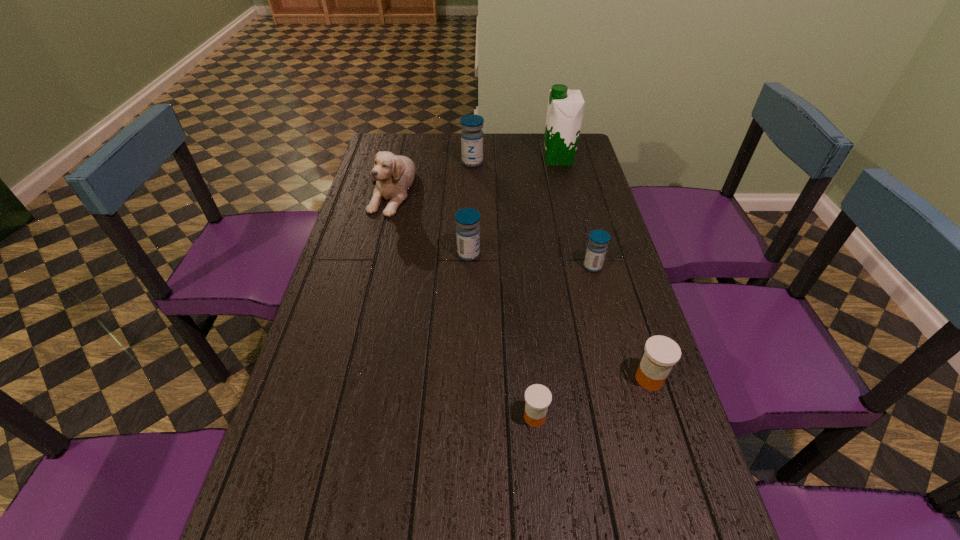
Locate an element on the screen. The image size is (960, 540). green soya milk is located at coordinates (565, 109).

This screenshot has width=960, height=540. I want to click on the tallest object, so click(x=565, y=109).

Identify the location of the farthest medicine. (471, 136).

The width and height of the screenshot is (960, 540). Find the location of `the tallest medicine`. the tallest medicine is located at coordinates (471, 136).

What are the coordinates of `white puppy` in the screenshot? It's located at (394, 174).

The image size is (960, 540). Identify the location of puppy. (394, 174).

Where is `the second biggest blue medicine`? The height and width of the screenshot is (540, 960). the second biggest blue medicine is located at coordinates (467, 219).

Find the location of a particular element. The width and height of the screenshot is (960, 540). the fourth shortest medicine is located at coordinates pyautogui.click(x=467, y=219).

Locate an element on the screen. the smallest blue medicine is located at coordinates (597, 246).

This screenshot has width=960, height=540. In order to click on the fourth farthest medicine in this screenshot , I will do (661, 353).